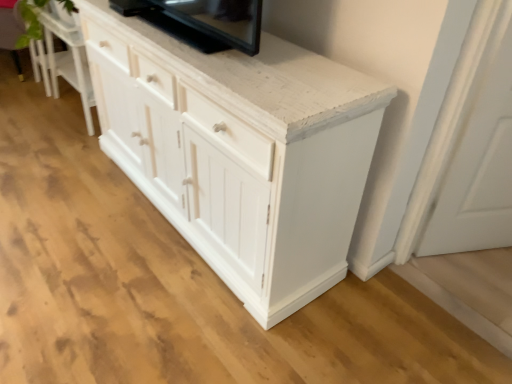
The width and height of the screenshot is (512, 384). I want to click on vacant space positioned to the left of white wood cabinet at lower left, so click(32, 110).